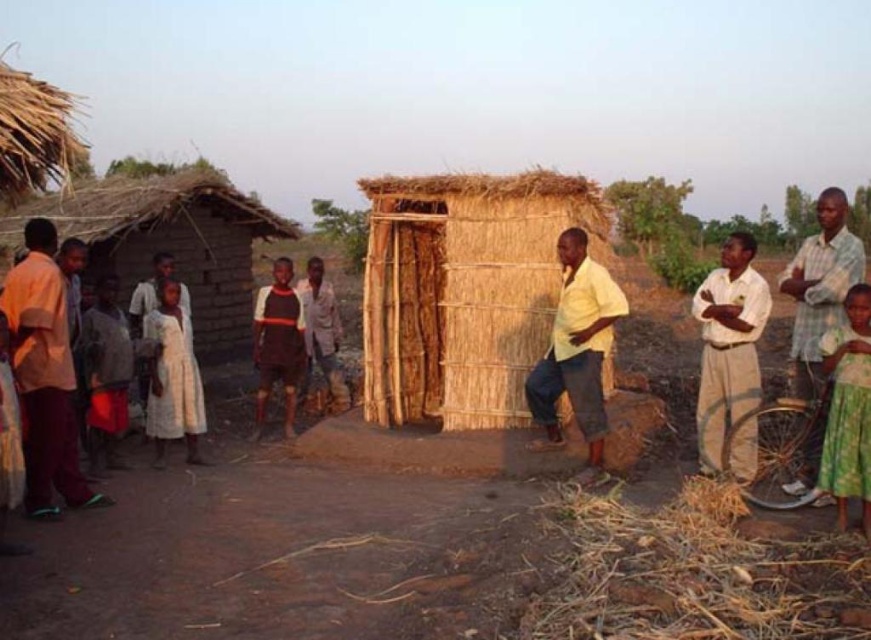
You are a photographer trying to capture both the light brown fabric shirt at left and the green textured dress at lower right in the same frame. Which clothing item appears bigger in the photo?

The light brown fabric shirt at left appears bigger in the photo because it has a larger size compared to the green textured dress at lower right.

You are standing at the center of the scene and want to pick up the brown straw hay at lower right. Which direction should you move to reach it?

The brown straw hay at lower right is located at point (694, 573), so you should move towards the lower right direction to reach it.